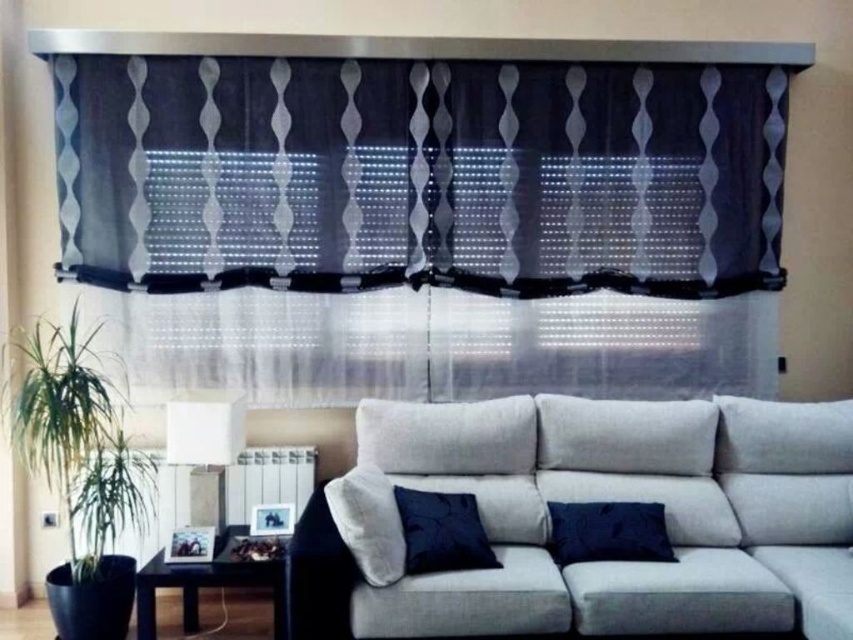
Question: Does light gray fabric couch at center have a smaller size compared to white fabric lampshade at left?

Choices:
 (A) yes
 (B) no

Answer: (B)

Question: Is textured gray curtain at upper center below dark blue velvet pillow at lower center?

Choices:
 (A) no
 (B) yes

Answer: (A)

Question: Is light gray fabric couch at center behind velvet dark blue pillow at center?

Choices:
 (A) yes
 (B) no

Answer: (B)

Question: Which point appears closest to the camera in this image?

Choices:
 (A) (56, 467)
 (B) (80, 92)

Answer: (A)

Question: Which of the following is the farthest from the observer?

Choices:
 (A) (451, 628)
 (B) (56, 371)

Answer: (B)

Question: Which object appears closest to the camera in this image?

Choices:
 (A) velvet dark blue pillow at center
 (B) white fabric lampshade at left
 (C) dark blue velvet pillow at lower center
 (D) dark blue velvet pillow at center

Answer: (D)